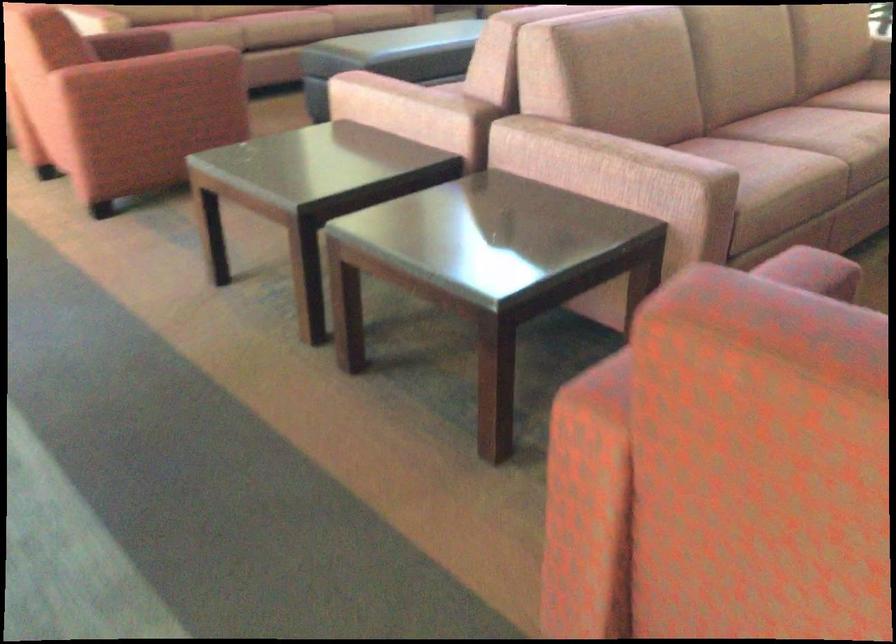
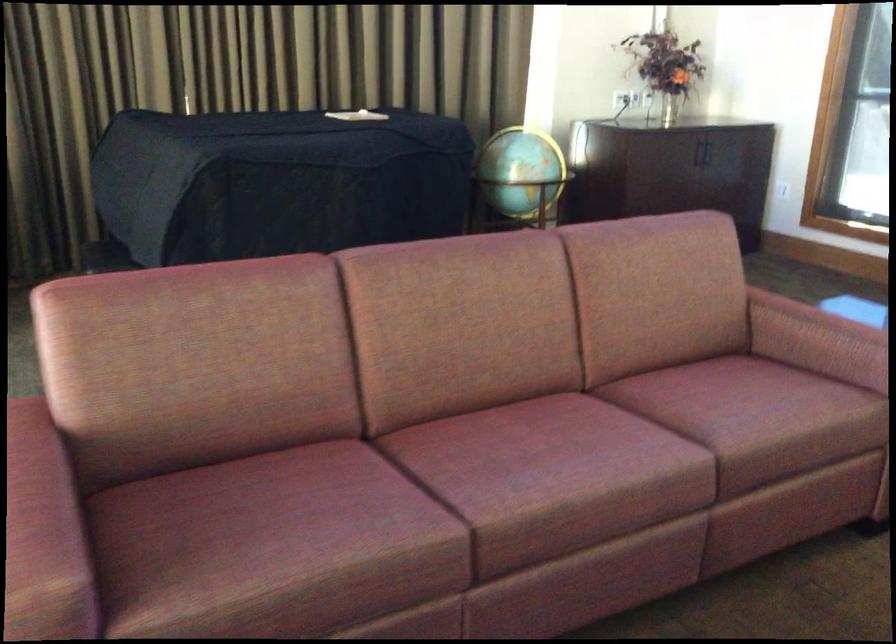
Question: In a continuous first-person perspective shot, in which direction is the camera moving?

Choices:
 (A) Left
 (B) Right
 (C) Forward
 (D) Backward

Answer: (C)